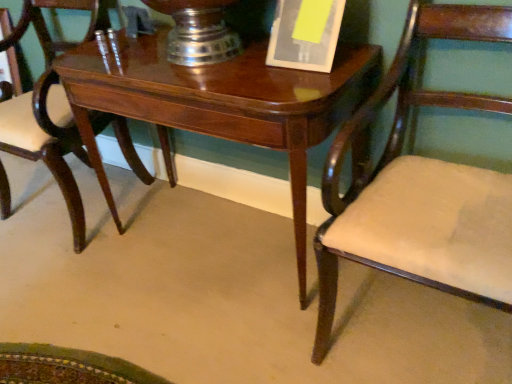
Locate an element on the screen. Image resolution: width=512 pixels, height=384 pixels. free area in between glossy wood table at center and matte wood chair at right, which appears as the first chair when viewed from the right is located at coordinates (229, 300).